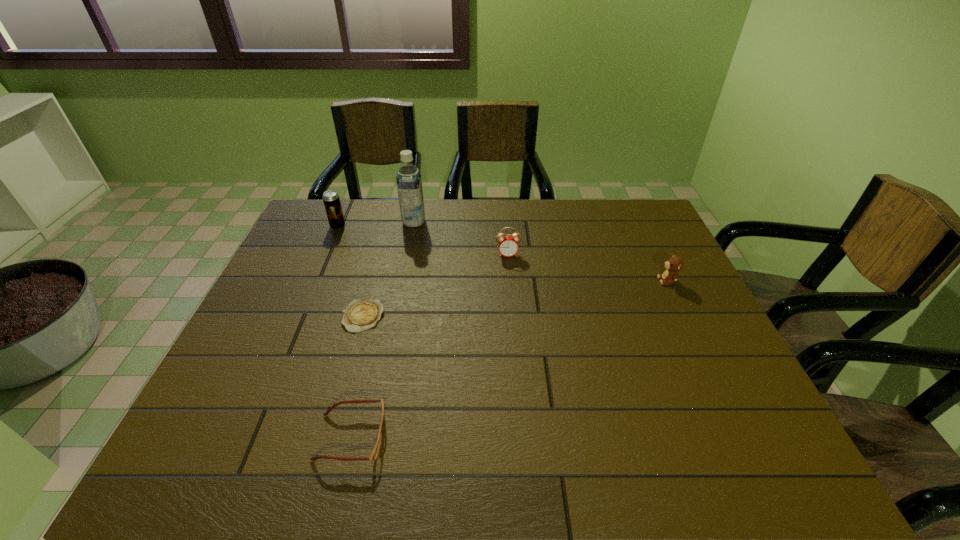
This screenshot has height=540, width=960. I want to click on quiche, so click(362, 314).

Find the location of a particular element. free space located 0.320m on the label of the soya milk is located at coordinates (520, 222).

At what (x,y) coordinates should I click in order to perform the action: click on vacant area situated on the front of the leftmost object. Please return your answer as a coordinate pair (x, y). Looking at the image, I should click on (302, 308).

The image size is (960, 540). I want to click on vacant space located on the clock face of the second object from right to left, so click(x=513, y=318).

At what (x,y) coordinates should I click in order to perform the action: click on free point located on the face of the rightmost object. Please return your answer as a coordinate pair (x, y). The width and height of the screenshot is (960, 540). Looking at the image, I should click on (630, 281).

I want to click on free space located on the face of the rightmost object, so click(x=525, y=281).

You are a GUI agent. You are given a task and a screenshot of the screen. Output one action in this format:
    pyautogui.click(x=<x>, y=<y>)
    Task: Click on the free space located on the face of the rightmost object
    
    Given the screenshot: What is the action you would take?
    pyautogui.click(x=570, y=281)

Locate an element on the screen. The height and width of the screenshot is (540, 960). vacant space located 0.110m on the front-facing side of the nearest object is located at coordinates (439, 437).

This screenshot has height=540, width=960. In order to click on free point located 0.140m on the left of the second nearest object in this screenshot , I will do `click(289, 316)`.

I want to click on soya milk present at the far edge, so click(x=409, y=182).